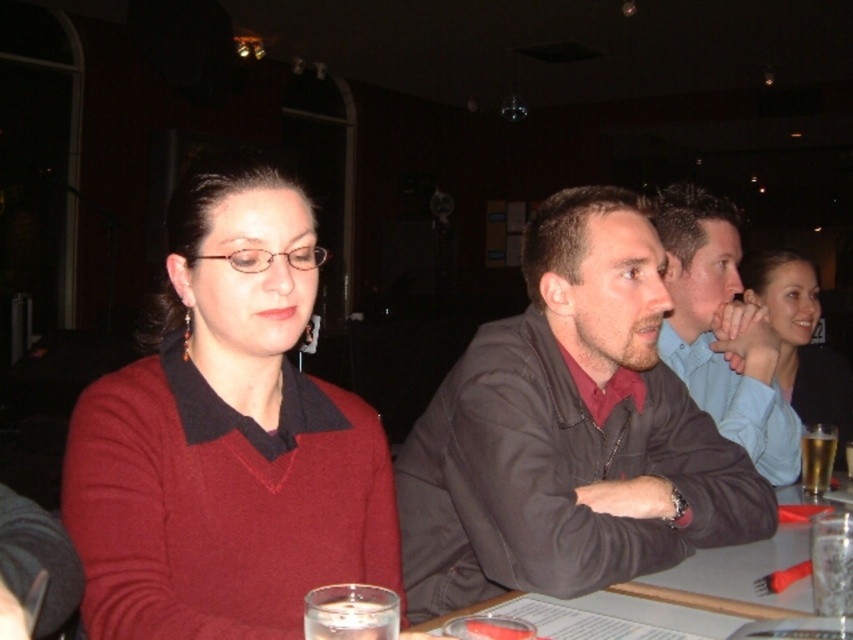
Who is positioned more to the right, dark brown leather jacket at center or clear glass at table right?

From the viewer's perspective, clear glass at table right appears more on the right side.

The image size is (853, 640). In order to click on dark brown leather jacket at center in this screenshot , I will do `click(569, 432)`.

Who is more distant from viewer, (x=653, y=516) or (x=834, y=557)?

Positioned behind is point (x=653, y=516).

Where is `dark brown leather jacket at center`? dark brown leather jacket at center is located at coordinates (569, 432).

Between smooth brown shirt at center and clear glass at table right, which one appears on the right side from the viewer's perspective?

smooth brown shirt at center is more to the right.

Is smooth brown shirt at center taller than clear glass at table right?

Yes, smooth brown shirt at center is taller than clear glass at table right.

Is point (677, 196) closer to camera compared to point (844, 556)?

No.

Locate an element on the screen. This screenshot has height=640, width=853. smooth brown shirt at center is located at coordinates pyautogui.click(x=722, y=332).

In order to click on dark brown leather jacket at center in this screenshot , I will do `click(569, 432)`.

Where is `dark brown leather jacket at center`? dark brown leather jacket at center is located at coordinates (569, 432).